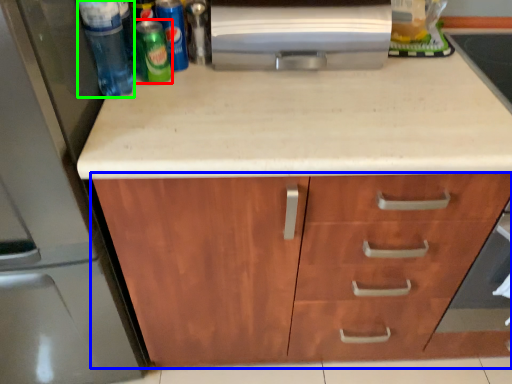
Question: Estimate the real-world distances between objects in this image. Which object is farther from beer (highlighted by a red box), cabinetry (highlighted by a blue box) or beverage (highlighted by a green box)?

Choices:
 (A) cabinetry
 (B) beverage

Answer: (A)